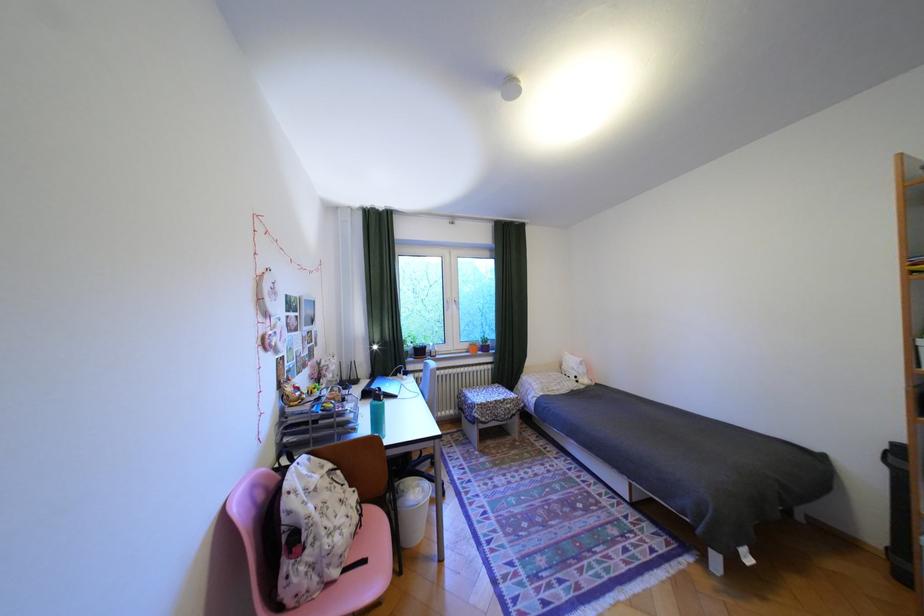
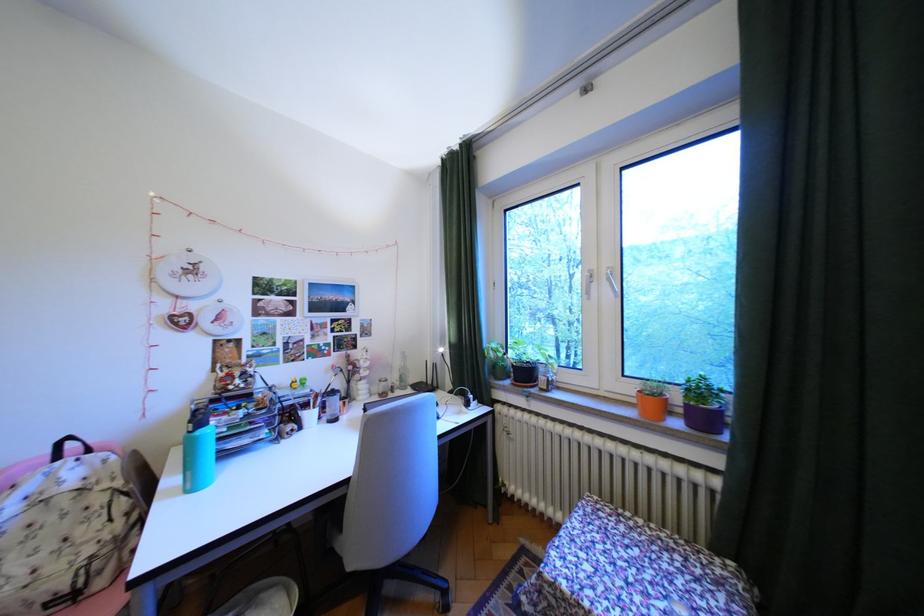
Where in the second image is the point corresponding to point (492, 405) from the first image?

(564, 585)